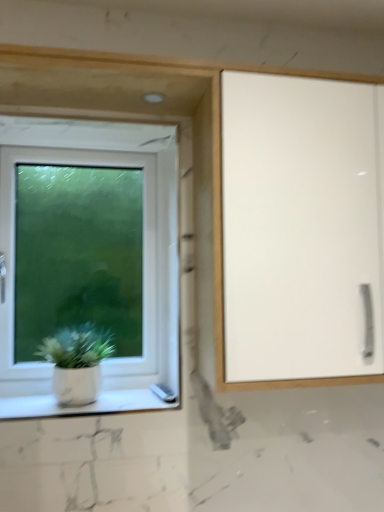
Question: Is point (64, 395) positioned closer to the camera than point (125, 307)?

Choices:
 (A) closer
 (B) farther

Answer: (A)

Question: Based on their positions, is white matte pot at lower left located to the left or right of white plastic window at left?

Choices:
 (A) right
 (B) left

Answer: (A)

Question: Based on their relative distances, which object is nearer to the white glossy cabinet at right?

Choices:
 (A) white plastic window at left
 (B) white marble window sill at lower left
 (C) white matte pot at lower left

Answer: (A)

Question: Estimate the real-world distances between objects in this image. Which object is farther from the white plastic window at left?

Choices:
 (A) white matte pot at lower left
 (B) white marble window sill at lower left
 (C) white glossy cabinet at right

Answer: (C)